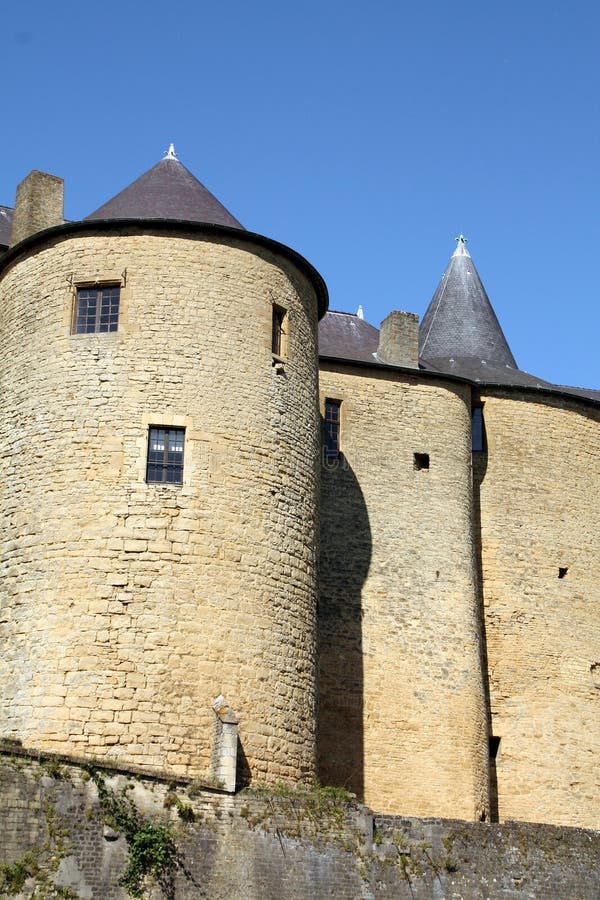
At what (x,y) coordinates should I click in order to perform the action: click on metal bracket. Please return your answer as a coordinate pair (x, y). Looking at the image, I should click on (123, 273), (70, 277).